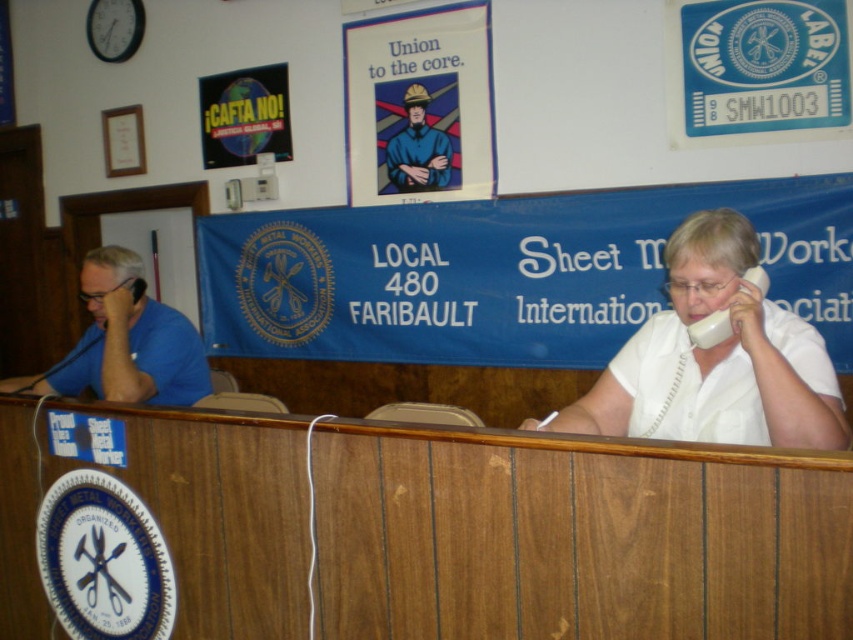
Question: Does white glossy phone at center have a smaller size compared to matte blue uniform at center?

Choices:
 (A) yes
 (B) no

Answer: (B)

Question: Can you confirm if wooden table at center is thinner than white glossy phone at center?

Choices:
 (A) yes
 (B) no

Answer: (B)

Question: From the image, what is the correct spatial relationship of blue shirt at left in relation to matte blue uniform at center?

Choices:
 (A) below
 (B) above

Answer: (A)

Question: Which of these objects is positioned farthest from the wooden table at center?

Choices:
 (A) matte blue uniform at center
 (B) blue shirt at left
 (C) white glossy phone at center

Answer: (A)

Question: Considering the real-world distances, which object is farthest from the matte blue uniform at center?

Choices:
 (A) wooden table at center
 (B) blue shirt at left

Answer: (A)

Question: Which object is positioned closest to the matte blue uniform at center?

Choices:
 (A) blue shirt at left
 (B) white glossy phone at center
 (C) wooden table at center

Answer: (A)